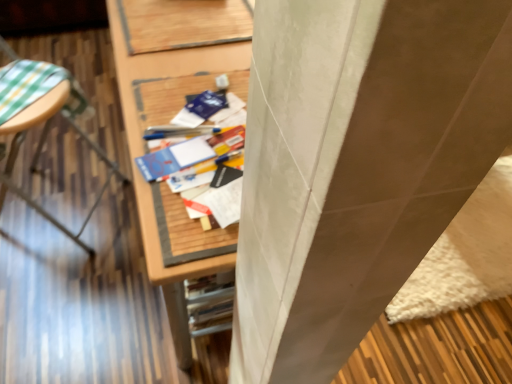
Measure the distance between point (x=186, y=114) and camera.

The depth of point (x=186, y=114) is 33.58 inches.

What do you see at coordinates (174, 158) in the screenshot?
I see `matte blue paperback book at center, the 2th paperback book positioned from the top` at bounding box center [174, 158].

Where is `wooden desk at center, acting as the 2th furniture starting from the left`? This screenshot has height=384, width=512. wooden desk at center, acting as the 2th furniture starting from the left is located at coordinates (163, 67).

Image resolution: width=512 pixels, height=384 pixels. I want to click on blue matte paper at center, which appears as the 1th paperback book when viewed from the top, so click(200, 109).

Between blue matte paper at center, arranged as the second paperback book when ordered from the bottom, and wooden table at left, positioned as the 1th furniture in left-to-right order, which one has larger width?

Wider between the two is wooden table at left, positioned as the 1th furniture in left-to-right order.

Considering the positions of points (183, 121) and (98, 152), is point (183, 121) closer to camera compared to point (98, 152)?

Yes, point (183, 121) is closer to viewer.

Is blue matte paper at center, which appears as the 1th paperback book when viewed from the top, not inside wooden table at left, positioned as the 1th furniture in left-to-right order?

Indeed, blue matte paper at center, which appears as the 1th paperback book when viewed from the top, is completely outside wooden table at left, positioned as the 1th furniture in left-to-right order.

In the scene shown: Is there a large distance between blue matte paper at center, which ranks as the 2th paperback book in front-to-back order, and wooden table at left, which is the second furniture from right to left?

No, blue matte paper at center, which ranks as the 2th paperback book in front-to-back order, is not far away from wooden table at left, which is the second furniture from right to left.

In the image, there is a blue matte paper at center, acting as the 1th paperback book starting from the back. At what (x,y) coordinates should I click in order to perform the action: click on paperback book below it (from a real-world perspective). Please return your answer as a coordinate pair (x, y). This screenshot has width=512, height=384. Looking at the image, I should click on (174, 158).

Does matte blue paperback book at center, which appears as the 1th paperback book when viewed from the front, have a greater height compared to blue matte paper at center, acting as the 1th paperback book starting from the back?

Correct, matte blue paperback book at center, which appears as the 1th paperback book when viewed from the front, is much taller as blue matte paper at center, acting as the 1th paperback book starting from the back.

Is matte blue paperback book at center, which appears as the 1th paperback book when viewed from the front, next to blue matte paper at center, arranged as the second paperback book when ordered from the bottom?

Yes, matte blue paperback book at center, which appears as the 1th paperback book when viewed from the front, is right next to blue matte paper at center, arranged as the second paperback book when ordered from the bottom, and making contact.

From the picture: Is wooden desk at center, which is counted as the first furniture, starting from the right, oriented towards wooden table at left, positioned as the 1th furniture in left-to-right order?

Yes, wooden desk at center, which is counted as the first furniture, starting from the right, faces towards wooden table at left, positioned as the 1th furniture in left-to-right order.

From a real-world perspective, which object rests below the other?

In real-world perspective, wooden desk at center, which is counted as the first furniture, starting from the right, is lower.

Which of these two, wooden desk at center, which is counted as the first furniture, starting from the right, or wooden table at left, which is the second furniture from right to left, is bigger?

With larger size is wooden desk at center, which is counted as the first furniture, starting from the right.

Is point (198, 51) closer or farther from the camera than point (35, 107)?

Point (198, 51) appears to be closer to the viewer than point (35, 107).

Does blue matte paper at center, acting as the 1th paperback book starting from the back, have a smaller size compared to matte blue paperback book at center, which appears as the 1th paperback book when viewed from the front?

Yes, blue matte paper at center, acting as the 1th paperback book starting from the back, is smaller than matte blue paperback book at center, which appears as the 1th paperback book when viewed from the front.

From the picture: Does blue matte paper at center, acting as the 1th paperback book starting from the back, have a greater height compared to matte blue paperback book at center, acting as the 2th paperback book starting from the back?

No, blue matte paper at center, acting as the 1th paperback book starting from the back, is not taller than matte blue paperback book at center, acting as the 2th paperback book starting from the back.

Considering the positions of objects blue matte paper at center, which ranks as the 2th paperback book in front-to-back order, and matte blue paperback book at center, the 2th paperback book positioned from the top, in the image provided, who is more to the right, blue matte paper at center, which ranks as the 2th paperback book in front-to-back order, or matte blue paperback book at center, the 2th paperback book positioned from the top,?

From the viewer's perspective, blue matte paper at center, which ranks as the 2th paperback book in front-to-back order, appears more on the right side.

From the image's perspective, is wooden table at left, which is the second furniture from right to left, on matte blue paperback book at center, acting as the 2th paperback book starting from the back?

Indeed, from the image's perspective, wooden table at left, which is the second furniture from right to left, is shown above matte blue paperback book at center, acting as the 2th paperback book starting from the back.

Is wooden table at left, positioned as the 1th furniture in left-to-right order, positioned with its back to matte blue paperback book at center, acting as the 2th paperback book starting from the back?

No, wooden table at left, positioned as the 1th furniture in left-to-right order,'s orientation is not away from matte blue paperback book at center, acting as the 2th paperback book starting from the back.

Is wooden table at left, positioned as the 1th furniture in left-to-right order, not inside matte blue paperback book at center, arranged as the 1th paperback book when ordered from the bottom?

wooden table at left, positioned as the 1th furniture in left-to-right order, lies outside matte blue paperback book at center, arranged as the 1th paperback book when ordered from the bottom,'s area.

How far apart are wooden table at left, which is the second furniture from right to left, and matte blue paperback book at center, the 2th paperback book positioned from the top?

A distance of 26.20 inches exists between wooden table at left, which is the second furniture from right to left, and matte blue paperback book at center, the 2th paperback book positioned from the top.

From a real-world perspective, is matte blue paperback book at center, arranged as the 1th paperback book when ordered from the bottom, on wooden desk at center, which is counted as the first furniture, starting from the right?

Yes.

Consider the image. Which is in front, matte blue paperback book at center, which appears as the 1th paperback book when viewed from the front, or wooden desk at center, which is counted as the first furniture, starting from the right?

wooden desk at center, which is counted as the first furniture, starting from the right, is closer to the camera.

How far apart are matte blue paperback book at center, the 2th paperback book positioned from the top, and wooden desk at center, which is counted as the first furniture, starting from the right?

matte blue paperback book at center, the 2th paperback book positioned from the top, is 18.53 centimeters from wooden desk at center, which is counted as the first furniture, starting from the right.

Is wooden desk at center, acting as the 2th furniture starting from the left, at the back of matte blue paperback book at center, arranged as the 1th paperback book when ordered from the bottom?

No, matte blue paperback book at center, arranged as the 1th paperback book when ordered from the bottom,'s orientation is not away from wooden desk at center, acting as the 2th furniture starting from the left.

In the image, is blue matte paper at center, which appears as the 1th paperback book when viewed from the top, positioned in front of or behind wooden desk at center, which is counted as the first furniture, starting from the right?

Visually, blue matte paper at center, which appears as the 1th paperback book when viewed from the top, is located behind wooden desk at center, which is counted as the first furniture, starting from the right.

Is blue matte paper at center, acting as the 1th paperback book starting from the back, turned away from wooden desk at center, acting as the 2th furniture starting from the left?

blue matte paper at center, acting as the 1th paperback book starting from the back, does not have its back to wooden desk at center, acting as the 2th furniture starting from the left.

Do you think blue matte paper at center, which appears as the 1th paperback book when viewed from the top, is within wooden desk at center, which is counted as the first furniture, starting from the right, or outside of it?

The correct answer is: outside.

Are blue matte paper at center, which appears as the 1th paperback book when viewed from the top, and wooden desk at center, which is counted as the first furniture, starting from the right, beside each other?

No, blue matte paper at center, which appears as the 1th paperback book when viewed from the top, is not with wooden desk at center, which is counted as the first furniture, starting from the right.

You are a GUI agent. You are given a task and a screenshot of the screen. Output one action in this format:
    pyautogui.click(x=<x>, y=<y>)
    Task: Click on the furniture above the blue matte paper at center, which ranks as the 2th paperback book in front-to-back order (from the image's perspective)
    This screenshot has width=512, height=384.
    Given the screenshot: What is the action you would take?
    coord(39,120)

Locate an element on the screen. The image size is (512, 384). paperback book on the left side of blue matte paper at center, arranged as the second paperback book when ordered from the bottom is located at coordinates (174, 158).

Estimate the real-world distances between objects in this image. Which object is closer to wooden desk at center, acting as the 2th furniture starting from the left, matte blue paperback book at center, acting as the 2th paperback book starting from the back, or wooden table at left, which is the second furniture from right to left?

matte blue paperback book at center, acting as the 2th paperback book starting from the back, is positioned closer to the anchor wooden desk at center, acting as the 2th furniture starting from the left.

Looking at this image, from the image, which object appears to be farther from wooden desk at center, acting as the 2th furniture starting from the left, matte blue paperback book at center, which appears as the 1th paperback book when viewed from the front, or blue matte paper at center, which ranks as the 2th paperback book in front-to-back order?

Among the two, matte blue paperback book at center, which appears as the 1th paperback book when viewed from the front, is located further to wooden desk at center, acting as the 2th furniture starting from the left.

Based on their spatial positions, is wooden table at left, positioned as the 1th furniture in left-to-right order, or wooden desk at center, which is counted as the first furniture, starting from the right, further from blue matte paper at center, which appears as the 1th paperback book when viewed from the top?

wooden table at left, positioned as the 1th furniture in left-to-right order, is positioned further to the anchor blue matte paper at center, which appears as the 1th paperback book when viewed from the top.

Which object lies nearer to the anchor point wooden table at left, which is the second furniture from right to left, matte blue paperback book at center, acting as the 2th paperback book starting from the back, or wooden desk at center, acting as the 2th furniture starting from the left?

The object closer to wooden table at left, which is the second furniture from right to left, is wooden desk at center, acting as the 2th furniture starting from the left.

Which object lies nearer to the anchor point matte blue paperback book at center, the 2th paperback book positioned from the top, wooden desk at center, which is counted as the first furniture, starting from the right, or wooden table at left, positioned as the 1th furniture in left-to-right order?

The object closer to matte blue paperback book at center, the 2th paperback book positioned from the top, is wooden desk at center, which is counted as the first furniture, starting from the right.

From the image, which object appears to be nearer to blue matte paper at center, which ranks as the 2th paperback book in front-to-back order, wooden desk at center, acting as the 2th furniture starting from the left, or matte blue paperback book at center, the 2th paperback book positioned from the top?

matte blue paperback book at center, the 2th paperback book positioned from the top, is positioned closer to the anchor blue matte paper at center, which ranks as the 2th paperback book in front-to-back order.

Looking at this image, which object lies further to the anchor point wooden table at left, positioned as the 1th furniture in left-to-right order, matte blue paperback book at center, the 2th paperback book positioned from the top, or blue matte paper at center, which ranks as the 2th paperback book in front-to-back order?

matte blue paperback book at center, the 2th paperback book positioned from the top, lies further to wooden table at left, positioned as the 1th furniture in left-to-right order, than the other object.

From the image, which object appears to be farther from matte blue paperback book at center, the 2th paperback book positioned from the top, blue matte paper at center, which appears as the 1th paperback book when viewed from the top, or wooden desk at center, which is counted as the first furniture, starting from the right?

wooden desk at center, which is counted as the first furniture, starting from the right.

You are a GUI agent. You are given a task and a screenshot of the screen. Output one action in this format:
    pyautogui.click(x=<x>, y=<y>)
    Task: Click on the paperback book between wooden desk at center, acting as the 2th furniture starting from the left, and blue matte paper at center, which ranks as the 2th paperback book in front-to-back order, in the front-back direction
    This screenshot has width=512, height=384.
    Given the screenshot: What is the action you would take?
    pyautogui.click(x=174, y=158)

The image size is (512, 384). What are the coordinates of `furniture between wooden table at left, which is the second furniture from right to left, and blue matte paper at center, which appears as the 1th paperback book when viewed from the top, from left to right` in the screenshot? It's located at (163, 67).

Find the location of a particular element. The image size is (512, 384). paperback book located between wooden table at left, which is the second furniture from right to left, and blue matte paper at center, arranged as the second paperback book when ordered from the bottom, in the left-right direction is located at coordinates (174, 158).

What are the coordinates of `paperback book between wooden table at left, which is the second furniture from right to left, and wooden desk at center, which is counted as the first furniture, starting from the right, from left to right` in the screenshot? It's located at (174, 158).